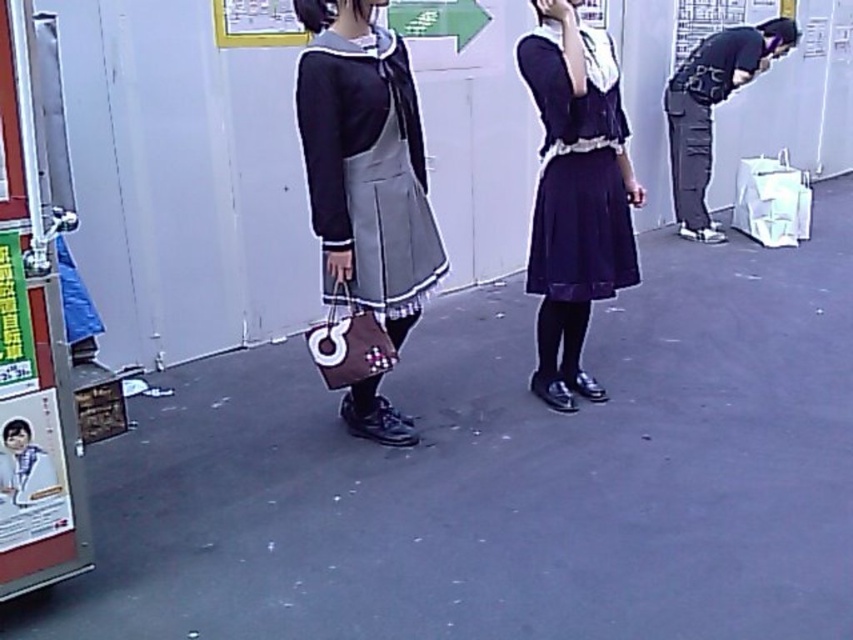
Question: Estimate the real-world distances between objects in this image. Which object is farther from the dark gray fabric pants at right?

Choices:
 (A) dark gray pants at right
 (B) navy satin dress at center
 (C) matte black sweater at center

Answer: (C)

Question: Considering the relative positions of dark gray pants at right and dark gray fabric pants at right in the image provided, where is dark gray pants at right located with respect to dark gray fabric pants at right?

Choices:
 (A) below
 (B) above

Answer: (B)

Question: From the image, what is the correct spatial relationship of dark gray pants at right in relation to dark gray fabric pants at right?

Choices:
 (A) above
 (B) below

Answer: (A)

Question: Which object is the farthest from the matte black sweater at center?

Choices:
 (A) dark gray fabric pants at right
 (B) dark gray pants at right
 (C) navy satin dress at center

Answer: (B)

Question: Estimate the real-world distances between objects in this image. Which object is closer to the dark gray pants at right?

Choices:
 (A) navy satin dress at center
 (B) matte black sweater at center
 (C) dark gray fabric pants at right

Answer: (C)

Question: Does dark gray pants at right come in front of dark gray fabric pants at right?

Choices:
 (A) no
 (B) yes

Answer: (B)